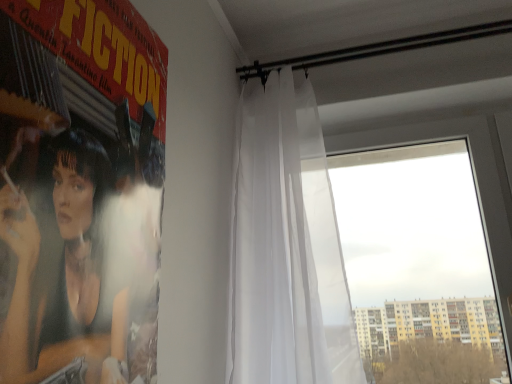
What do you see at coordinates (286, 247) in the screenshot? I see `white sheer curtain at upper center` at bounding box center [286, 247].

Describe the element at coordinates (81, 248) in the screenshot. The width and height of the screenshot is (512, 384). I see `matte black poster at left` at that location.

You are a GUI agent. You are given a task and a screenshot of the screen. Output one action in this format:
    pyautogui.click(x=<x>, y=<y>)
    Task: Click on the white sheer curtain at upper center
    This screenshot has width=512, height=384.
    Given the screenshot: What is the action you would take?
    pyautogui.click(x=286, y=247)

Would you consider white sheer curtain at upper center to be distant from matte black poster at left?

No, white sheer curtain at upper center is not far from matte black poster at left.

Do you think white sheer curtain at upper center is within matte black poster at left, or outside of it?

white sheer curtain at upper center is spatially situated outside matte black poster at left.

Is point (275, 133) farther from camera compared to point (14, 196)?

Yes, point (275, 133) is farther from viewer.

From the image's perspective, would you say white sheer curtain at upper center is positioned over matte black poster at left?

No, from the image's perspective, white sheer curtain at upper center is not above matte black poster at left.

Is matte black poster at left turned away from white sheer curtain at upper center?

No, matte black poster at left is not facing away from white sheer curtain at upper center.

Which is more to the right, matte black poster at left or white sheer curtain at upper center?

white sheer curtain at upper center.

Considering the sizes of objects matte black poster at left and white sheer curtain at upper center in the image provided, who is bigger, matte black poster at left or white sheer curtain at upper center?

Bigger between the two is white sheer curtain at upper center.

Measure the distance from matte black poster at left to white sheer curtain at upper center.

matte black poster at left is 28.82 inches away from white sheer curtain at upper center.

Considering the sizes of white sheer curtain at upper center and transparent glass window at right in the image, is white sheer curtain at upper center taller or shorter than transparent glass window at right?

In the image, white sheer curtain at upper center appears to be taller than transparent glass window at right.

Who is smaller, white sheer curtain at upper center or transparent glass window at right?

transparent glass window at right.

Based on the photo, from the image's perspective, is white sheer curtain at upper center located beneath transparent glass window at right?

No, from the image's perspective, white sheer curtain at upper center is not below transparent glass window at right.

From the image's perspective, which one is positioned lower, transparent glass window at right or matte black poster at left?

transparent glass window at right appears lower in the image.

You are a GUI agent. You are given a task and a screenshot of the screen. Output one action in this format:
    pyautogui.click(x=<x>, y=<y>)
    Task: Click on the window on the right of the matte black poster at left
    The width and height of the screenshot is (512, 384).
    Given the screenshot: What is the action you would take?
    pyautogui.click(x=475, y=177)

Between transparent glass window at right and matte black poster at left, which one has less height?

matte black poster at left is shorter.

Based on their sizes in the image, would you say transparent glass window at right is bigger or smaller than matte black poster at left?

Considering their sizes, transparent glass window at right takes up more space than matte black poster at left.

From the picture: Can you see matte black poster at left touching transparent glass window at right?

matte black poster at left is not next to transparent glass window at right, and they're not touching.

Does matte black poster at left appear on the left side of transparent glass window at right?

Yes.

Looking at the image, does matte black poster at left seem bigger or smaller compared to transparent glass window at right?

In the image, matte black poster at left appears to be smaller than transparent glass window at right.

Is matte black poster at left outside of transparent glass window at right?

matte black poster at left lies outside transparent glass window at right's area.

Looking at this image, how different are the orientations of transparent glass window at right and white sheer curtain at upper center in degrees?

The facing directions of transparent glass window at right and white sheer curtain at upper center are 0.0168 degrees apart.

Is point (511, 324) positioned after point (237, 206)?

No.

Could you tell me if transparent glass window at right is turned towards white sheer curtain at upper center?

Yes, transparent glass window at right is oriented towards white sheer curtain at upper center.

Does transparent glass window at right have a smaller size compared to white sheer curtain at upper center?

Yes.

Locate an element on the screen. This screenshot has height=384, width=512. curtain behind the matte black poster at left is located at coordinates (286, 247).

Find the location of a particular element. The image size is (512, 384). person located above the white sheer curtain at upper center (from the image's perspective) is located at coordinates (81, 248).

Considering their positions, is white sheer curtain at upper center positioned further to matte black poster at left than transparent glass window at right?

Among the two, transparent glass window at right is located further to matte black poster at left.

When comparing their distances from matte black poster at left, does transparent glass window at right or white sheer curtain at upper center seem further?

The object further to matte black poster at left is transparent glass window at right.

Estimate the real-world distances between objects in this image. Which object is further from white sheer curtain at upper center, matte black poster at left or transparent glass window at right?

matte black poster at left is further to white sheer curtain at upper center.

Estimate the real-world distances between objects in this image. Which object is closer to white sheer curtain at upper center, transparent glass window at right or matte black poster at left?

transparent glass window at right lies closer to white sheer curtain at upper center than the other object.

When comparing their distances from transparent glass window at right, does white sheer curtain at upper center or matte black poster at left seem closer?

white sheer curtain at upper center.

Estimate the real-world distances between objects in this image. Which object is closer to transparent glass window at right, matte black poster at left or white sheer curtain at upper center?

Based on the image, white sheer curtain at upper center appears to be nearer to transparent glass window at right.

The image size is (512, 384). Identify the location of curtain located between matte black poster at left and transparent glass window at right in the left-right direction. (286, 247).